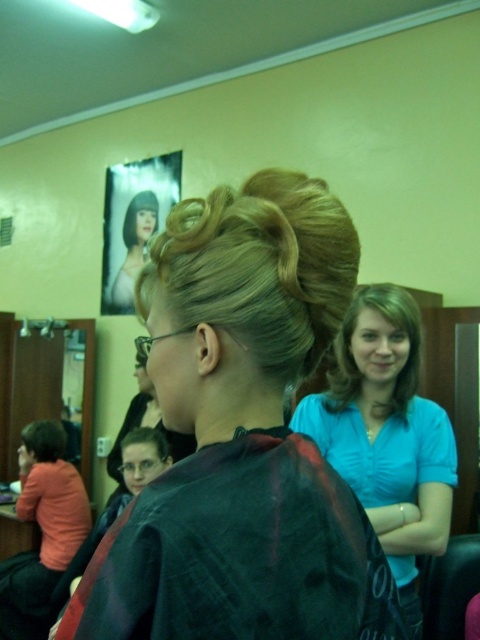
Question: Where is blonde hair at upper center located in relation to short dark hair at lower left in the image?

Choices:
 (A) above
 (B) below

Answer: (A)

Question: Which object is the closest to the blue matte shirt at center?

Choices:
 (A) short dark hair at lower left
 (B) blonde hair at upper center
 (C) blonde hair at center
 (D) blonde shiny hair bun at upper center

Answer: (C)

Question: Which is farther from the short dark hair at lower left?

Choices:
 (A) blonde hair at center
 (B) shiny brown hair bun at upper center
 (C) blonde silky hair at center
 (D) blonde shiny hair bun at upper center

Answer: (A)

Question: Is blue matte shirt at center to the right of shiny brown hair bun at upper center from the viewer's perspective?

Choices:
 (A) yes
 (B) no

Answer: (A)

Question: Among these objects, which one is nearest to the camera?

Choices:
 (A) blonde shiny hair bun at upper center
 (B) blonde hair at upper center
 (C) blonde silky hair at center

Answer: (A)

Question: Does matte black hair at center have a larger size compared to shiny brown hair bun at upper center?

Choices:
 (A) yes
 (B) no

Answer: (A)